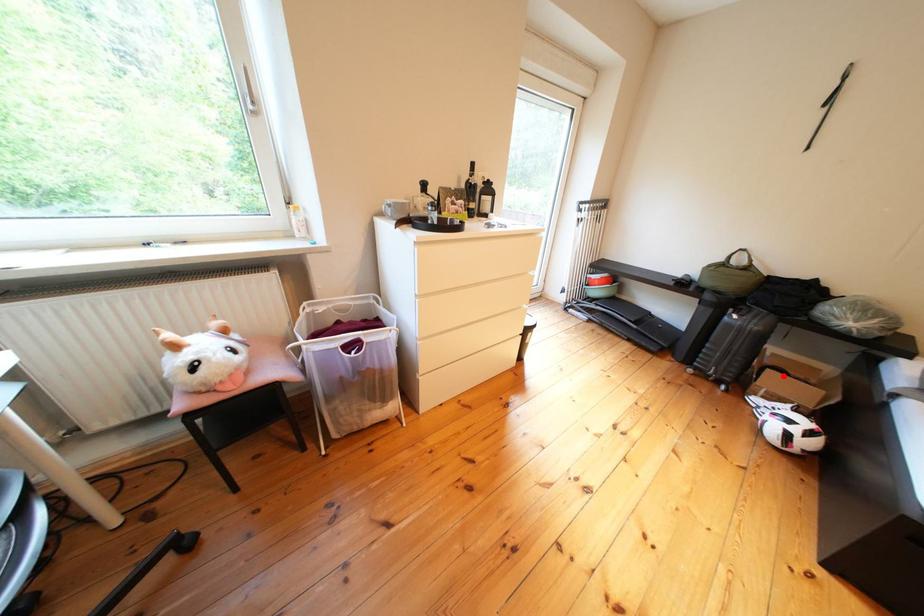
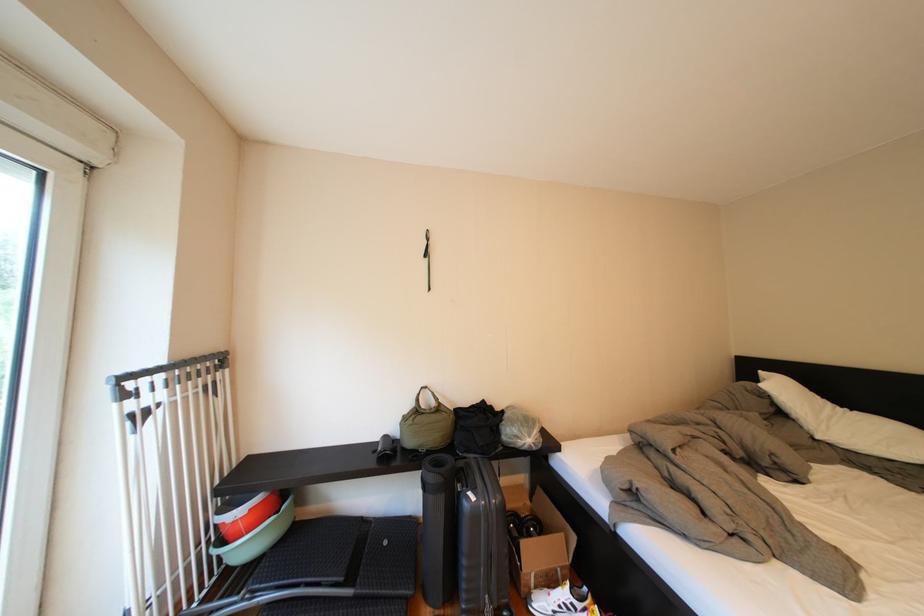
Where in the second image is the point corresponding to the highlighted location from the first image?

(538, 548)